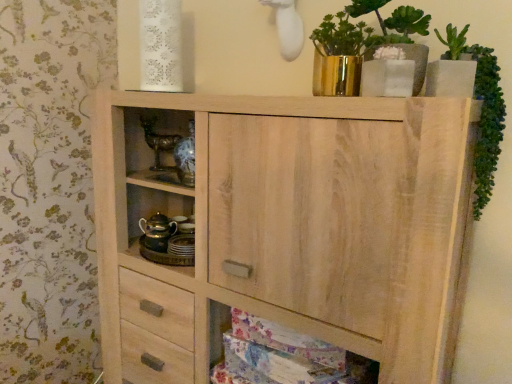
Question: Is green leafy plant at upper right smaller than natural wood cabinet at lower center?

Choices:
 (A) no
 (B) yes

Answer: (B)

Question: Is green leafy plant at upper right with natural wood cabinet at lower center?

Choices:
 (A) no
 (B) yes

Answer: (A)

Question: From the image's perspective, would you say green leafy plant at upper right is shown under natural wood cabinet at lower center?

Choices:
 (A) no
 (B) yes

Answer: (A)

Question: Is the position of green leafy plant at upper right more distant than that of natural wood cabinet at lower center?

Choices:
 (A) yes
 (B) no

Answer: (B)

Question: Does green leafy plant at upper right appear on the left side of natural wood cabinet at lower center?

Choices:
 (A) yes
 (B) no

Answer: (B)

Question: From a real-world perspective, is green leafy plant at upper right positioned above or below natural wood cabinet at lower center?

Choices:
 (A) above
 (B) below

Answer: (A)

Question: Is green leafy plant at upper right bigger or smaller than natural wood cabinet at lower center?

Choices:
 (A) small
 (B) big

Answer: (A)

Question: Is green leafy plant at upper right taller or shorter than natural wood cabinet at lower center?

Choices:
 (A) short
 (B) tall

Answer: (B)

Question: Is point (458, 39) positioned closer to the camera than point (351, 365)?

Choices:
 (A) closer
 (B) farther

Answer: (A)

Question: From a real-world perspective, relative to natural wood cabinet at center, is green leafy plant at upper right vertically above or below?

Choices:
 (A) below
 (B) above

Answer: (B)

Question: From the image's perspective, relative to natural wood cabinet at center, is green leafy plant at upper right above or below?

Choices:
 (A) above
 (B) below

Answer: (A)

Question: Is point (458, 43) closer or farther from the camera than point (397, 208)?

Choices:
 (A) farther
 (B) closer

Answer: (A)

Question: Considering the positions of green leafy plant at upper right and natural wood cabinet at center in the image, is green leafy plant at upper right taller or shorter than natural wood cabinet at center?

Choices:
 (A) tall
 (B) short

Answer: (B)

Question: Would you say natural wood cabinet at center is to the left or to the right of gold metallic teapot at center left in the picture?

Choices:
 (A) right
 (B) left

Answer: (A)

Question: In the image, is natural wood cabinet at center positioned in front of or behind gold metallic teapot at center left?

Choices:
 (A) front
 (B) behind

Answer: (A)